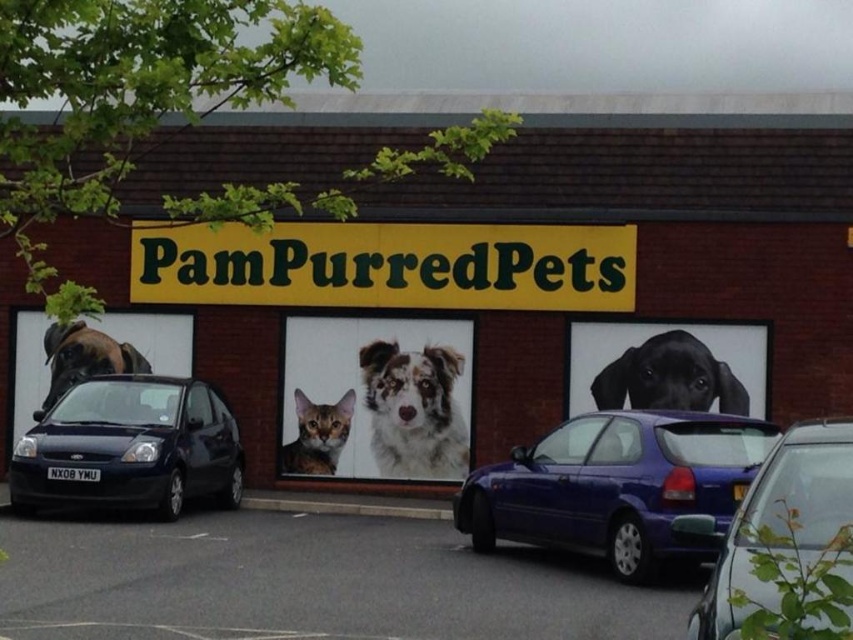
Question: Does matte black hatchback at lower left appear on the right side of matte brown dog at center?

Choices:
 (A) no
 (B) yes

Answer: (B)

Question: Which object appears farthest from the camera in this image?

Choices:
 (A) white fur dog at center
 (B) black glossy dog at center
 (C) matte black hatchback at lower left

Answer: (A)

Question: Which object is the closest to the matte black signboard at center?

Choices:
 (A) metallic blue hatchback at center right
 (B) fluffy white dog at center
 (C) matte brown dog at center

Answer: (B)

Question: Does metallic blue hatchback at lower right come in front of matte brown dog at center?

Choices:
 (A) yes
 (B) no

Answer: (A)

Question: Considering the real-world distances, which object is closest to the matte black hatchback at lower left?

Choices:
 (A) black glossy dog at center
 (B) metallic blue hatchback at center right
 (C) metallic blue hatchback at lower right

Answer: (B)

Question: Is black glossy dog at center further to the viewer compared to matte brown dog at center?

Choices:
 (A) no
 (B) yes

Answer: (A)